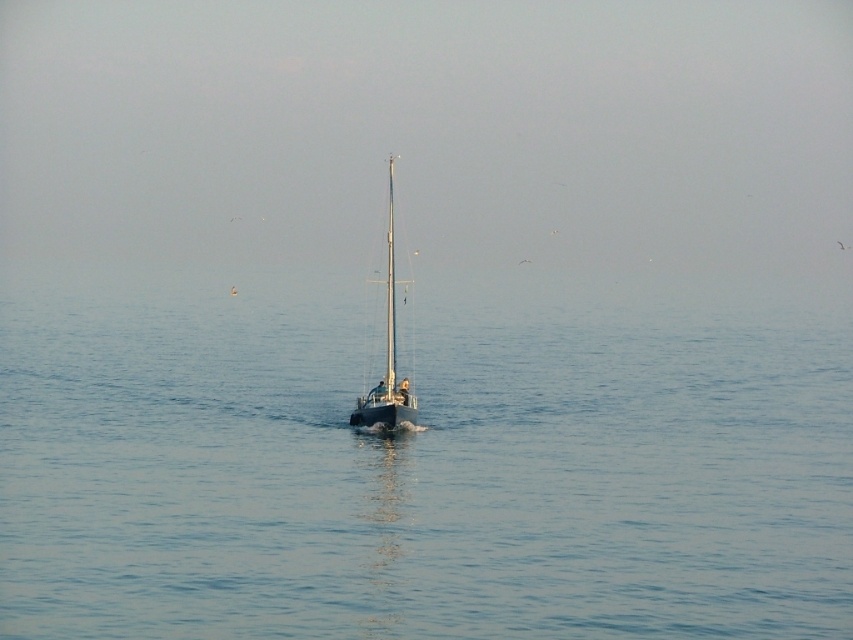
You are an observer standing on the dock watching the shiny black sailboat at center and the shiny silver mast at center. Which object is taller?

The shiny black sailboat at center is taller than the shiny silver mast at center.

You are a photographer trying to capture the shiny black sailboat at center and the blue water at center in a single shot. Which object will appear taller in the photo?

The shiny black sailboat at center appears taller than the blue water at center in the photo.